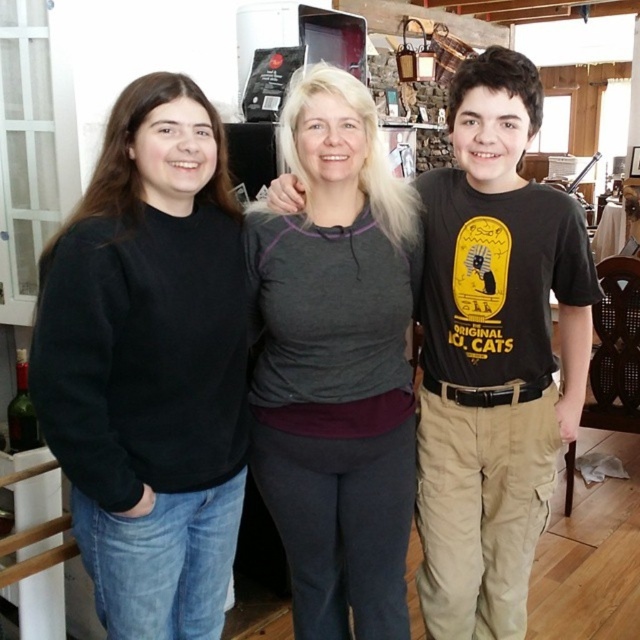
Can you confirm if black matte sweatshirt at left is smaller than gray fleece at center?

Indeed, black matte sweatshirt at left has a smaller size compared to gray fleece at center.

Between black matte sweatshirt at left and gray fleece at center, which one has more height?

gray fleece at center is taller.

Does point (138, 580) come farther from viewer compared to point (403, 625)?

No, it is not.

Image resolution: width=640 pixels, height=640 pixels. In order to click on black matte sweatshirt at left in this screenshot , I will do `click(148, 364)`.

Does black matte sweatshirt at left appear on the right side of black cotton t-shirt at center?

No, black matte sweatshirt at left is not to the right of black cotton t-shirt at center.

Between black matte sweatshirt at left and black cotton t-shirt at center, which one has less height?

Standing shorter between the two is black matte sweatshirt at left.

Is point (90, 212) farther from viewer compared to point (540, 500)?

No, (90, 212) is in front of (540, 500).

Image resolution: width=640 pixels, height=640 pixels. What are the coordinates of `black matte sweatshirt at left` in the screenshot? It's located at (148, 364).

Who is shorter, black cotton t-shirt at center or gray fleece at center?

Standing shorter between the two is gray fleece at center.

Is black cotton t-shirt at center further to the viewer compared to gray fleece at center?

No, it is not.

Is point (564, 400) more distant than point (298, 323)?

Yes, point (564, 400) is behind point (298, 323).

Identify the location of black cotton t-shirt at center. (493, 353).